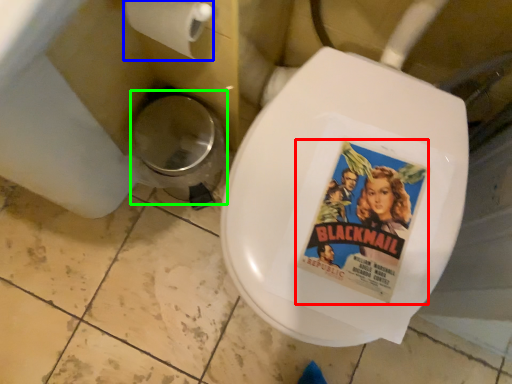
Question: Based on their relative distances, which object is nearer to movie poster (highlighted by a red box)? Choose from toilet paper (highlighted by a blue box) and potty (highlighted by a green box).

Choices:
 (A) toilet paper
 (B) potty

Answer: (A)